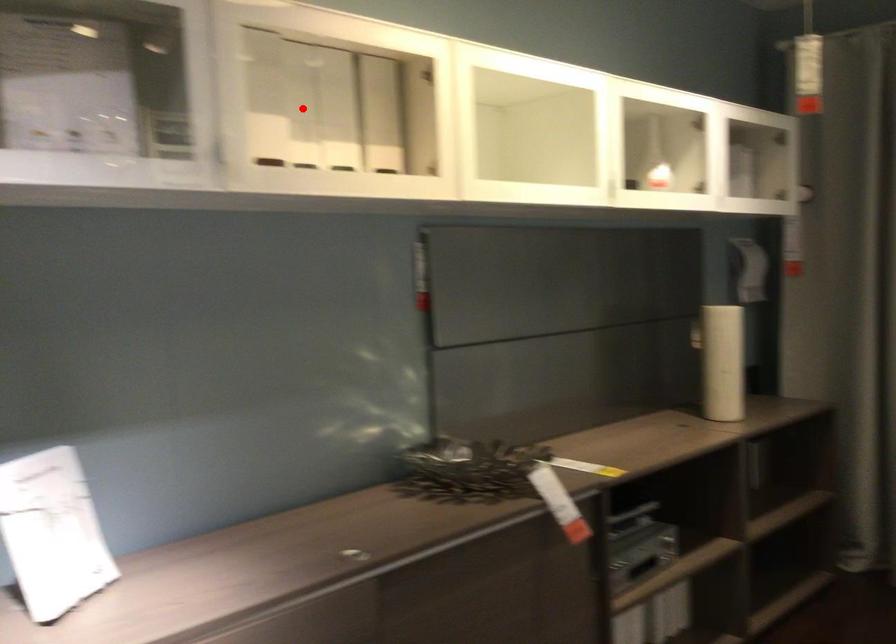
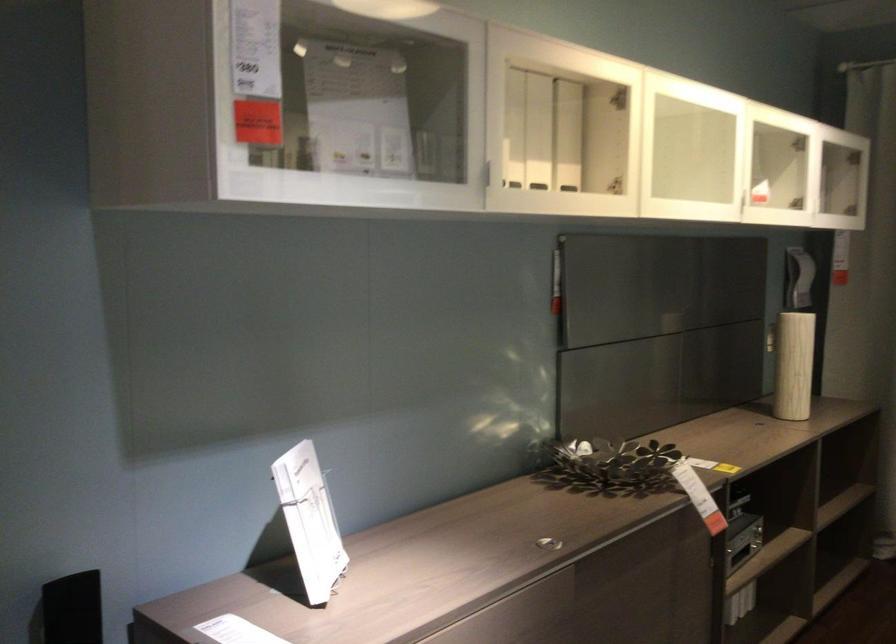
Question: I am providing you with two images of the same scene from different viewpoints. A red point is marked on the first image. Is the red point's position out of view in image 2?

Choices:
 (A) Yes
 (B) No

Answer: (B)